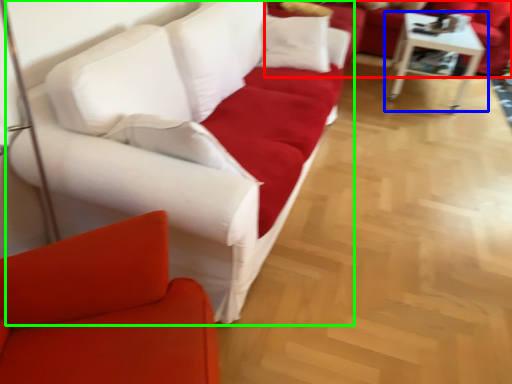
Question: Which object is positioned farthest from studio couch (highlighted by a red box)? Select from table (highlighted by a blue box) and studio couch (highlighted by a green box).

Choices:
 (A) table
 (B) studio couch

Answer: (B)